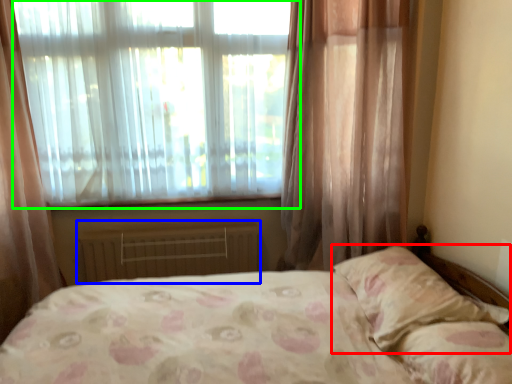
Question: Which is nearer to the pillow (highlighted by a red box)? radiator (highlighted by a blue box) or window (highlighted by a green box).

Choices:
 (A) radiator
 (B) window

Answer: (A)